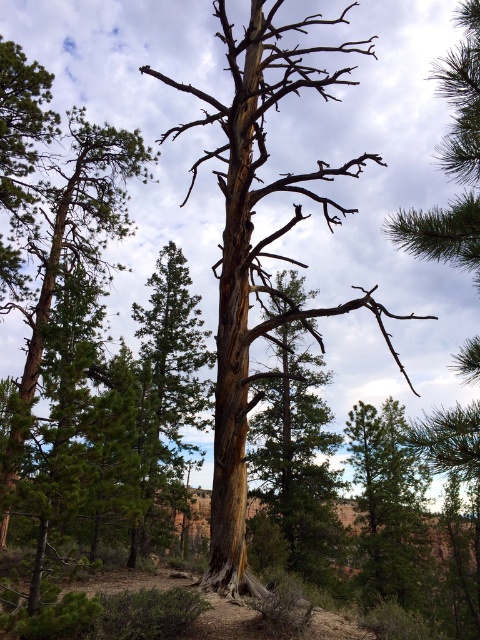
Question: Is brown textured bark tree at center to the right of green matte tree at center from the viewer's perspective?

Choices:
 (A) no
 (B) yes

Answer: (A)

Question: Considering the real-world distances, which object is farthest from the smooth bark tree at center?

Choices:
 (A) green matte tree at center
 (B) brown textured bark tree at center

Answer: (B)

Question: Which point appears farthest from the camera in this image?

Choices:
 (A) (242, 220)
 (B) (278, 284)

Answer: (B)

Question: Which of the following is the closest to the observer?

Choices:
 (A) (254, 385)
 (B) (236, 392)

Answer: (B)

Question: Can you confirm if brown textured bark tree at center is thinner than smooth bark tree at center?

Choices:
 (A) no
 (B) yes

Answer: (A)

Question: Is brown textured bark tree at center in front of green matte tree at center?

Choices:
 (A) no
 (B) yes

Answer: (A)